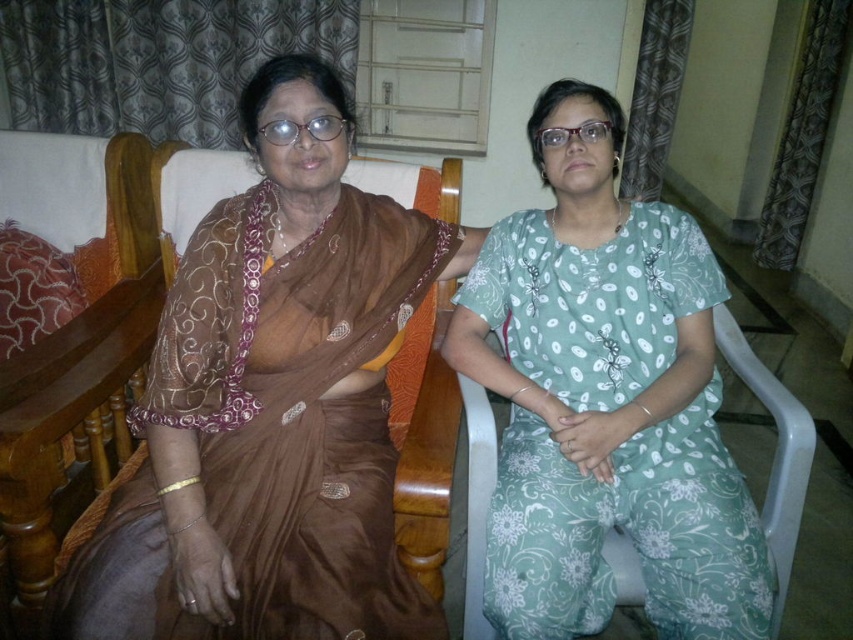
Does brown satin saree at left have a greater width compared to green floral dress at center?

Indeed, brown satin saree at left has a greater width compared to green floral dress at center.

Between brown satin saree at left and green floral dress at center, which one has more height?

With more height is green floral dress at center.

Find the location of a particular element. This screenshot has height=640, width=853. brown satin saree at left is located at coordinates (271, 404).